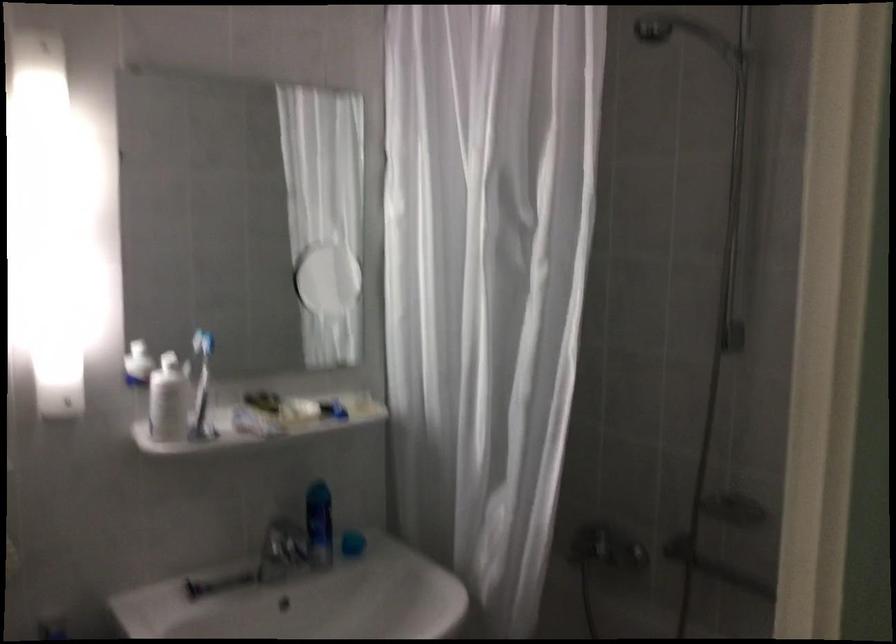
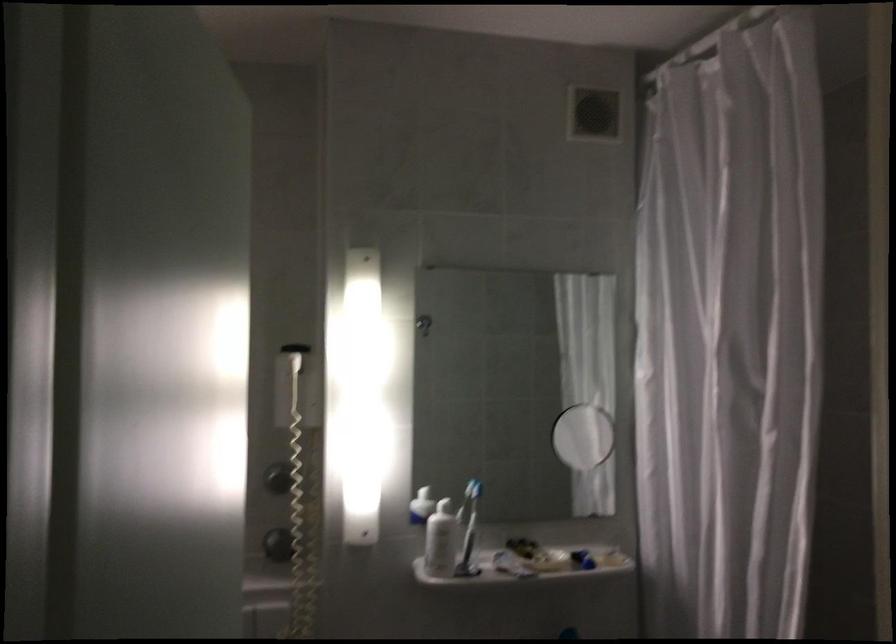
In the second image, find the point that corresponds to point (168, 401) in the first image.

(441, 541)